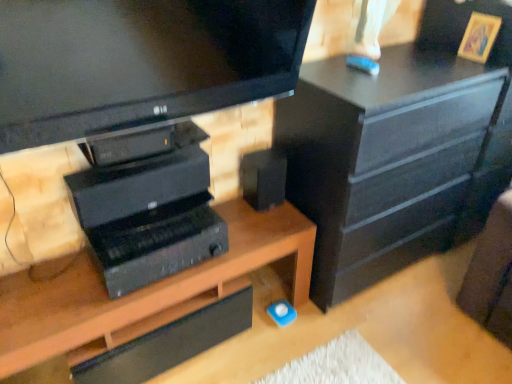
Where is `spots to the right of wooden desk at center`? This screenshot has height=384, width=512. spots to the right of wooden desk at center is located at coordinates (340, 347).